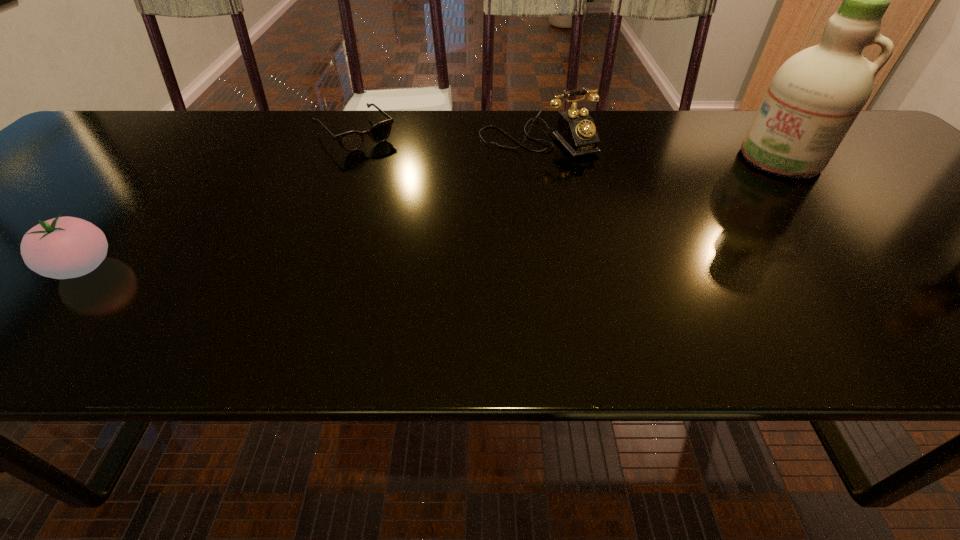
Find the location of a particular element. vacant space located on the front label of the tallest object is located at coordinates (745, 193).

At what (x,y) coordinates should I click in order to perform the action: click on vacant space located 0.200m on the front label of the tallest object. Please return your answer as a coordinate pair (x, y). Looking at the image, I should click on (727, 210).

The height and width of the screenshot is (540, 960). What are the coordinates of `vacant space located on the dial of the telephone` in the screenshot? It's located at (577, 181).

Locate an element on the screen. The width and height of the screenshot is (960, 540). vacant space located 0.330m on the dial of the telephone is located at coordinates (631, 245).

At what (x,y) coordinates should I click in order to perform the action: click on free spot located on the dial of the telephone. Please return your answer as a coordinate pair (x, y). Looking at the image, I should click on (622, 236).

The image size is (960, 540). I want to click on free space located 0.060m on the front lenses of the third object from right to left, so click(x=384, y=162).

Find the location of `vacant space located 0.350m on the front lenses of the third object from right to left`. vacant space located 0.350m on the front lenses of the third object from right to left is located at coordinates (447, 225).

Identify the location of vacant area located on the front lenses of the third object from right to left. The height and width of the screenshot is (540, 960). click(x=447, y=225).

The image size is (960, 540). What are the coordinates of `cleansing agent positioned at the far edge` in the screenshot? It's located at (814, 98).

Locate an element on the screen. This screenshot has width=960, height=540. telephone at the far edge is located at coordinates (576, 131).